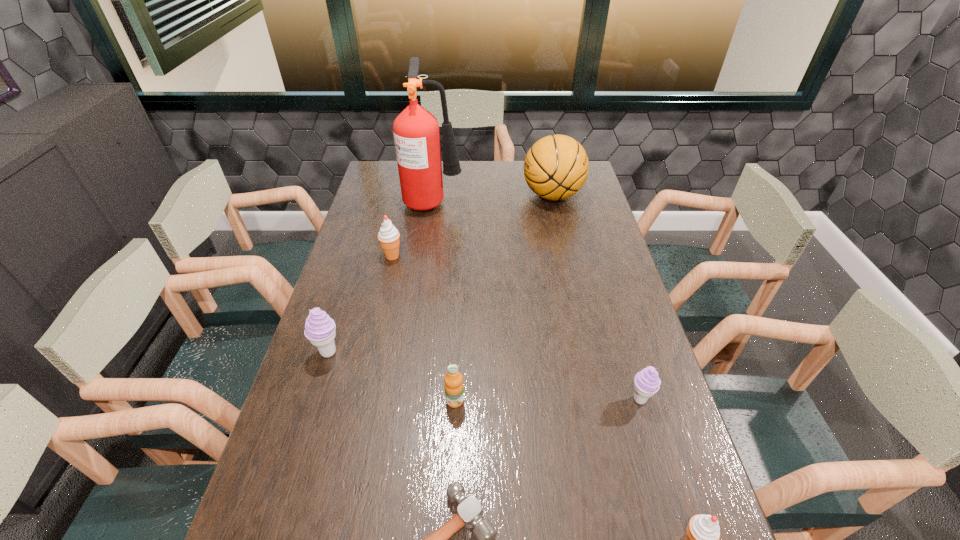
What are the coordinates of `the nearer purple icecream` in the screenshot? It's located at (646, 383).

Identify the location of blank space located at the nozzle of the tallest object. This screenshot has width=960, height=540. (493, 200).

You are a GUI agent. You are given a task and a screenshot of the screen. Output one action in this format:
    pyautogui.click(x=<x>, y=<y>)
    Task: Click on the free space located on the surface of the second tallest object near the brand logo
    The image size is (960, 540).
    Given the screenshot: What is the action you would take?
    pyautogui.click(x=469, y=195)

Image resolution: width=960 pixels, height=540 pixels. I want to click on free space located on the surface of the second tallest object near the brand logo, so click(x=477, y=195).

Identify the location of vacant space located 0.070m on the surface of the second tallest object near the brand logo. (504, 195).

Find the location of a particular element. free space located on the back of the left red icecream is located at coordinates coord(398,227).

At what (x,y) coordinates should I click in order to perform the action: click on vacant space situated on the back of the leftmost object. Please return your answer as a coordinate pair (x, y). The image size is (960, 540). Looking at the image, I should click on (360, 251).

The height and width of the screenshot is (540, 960). In order to click on vacant space located 0.180m on the label of the orange juice in this screenshot , I will do `click(451, 484)`.

Find the location of a particular element. The width and height of the screenshot is (960, 540). free region located on the back of the nearer purple icecream is located at coordinates (610, 299).

Where is `fire extinguisher that is at the far edge`? The height and width of the screenshot is (540, 960). fire extinguisher that is at the far edge is located at coordinates (416, 133).